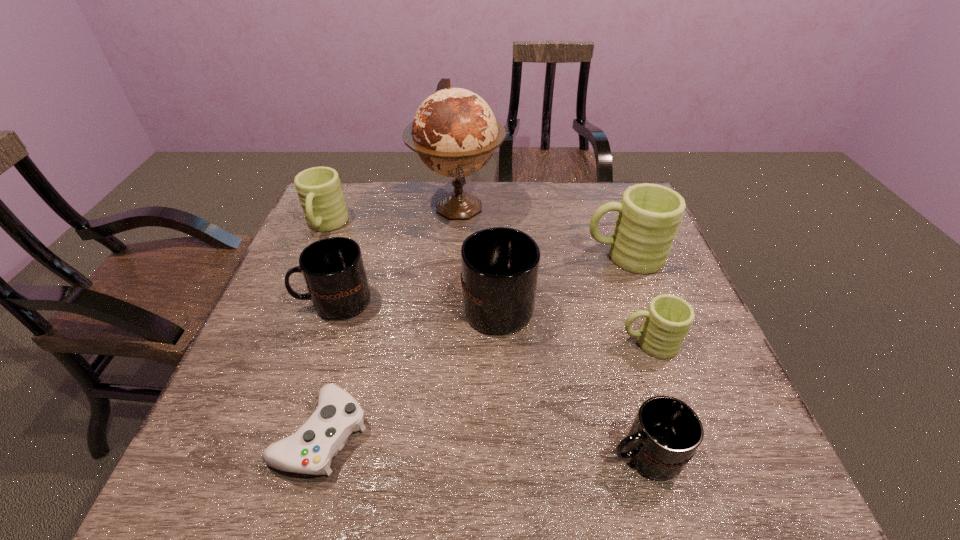
Find the location of a particular element. This screenshot has height=540, width=960. control at the left edge is located at coordinates (310, 450).

Image resolution: width=960 pixels, height=540 pixels. Identify the location of object that is at the far left corner. (320, 194).

Image resolution: width=960 pixels, height=540 pixels. Identify the location of object that is at the near left corner. (310, 450).

At what (x,y) coordinates should I click in order to perform the action: click on object that is positioned at the near right corner. Please return your answer as a coordinate pair (x, y). Image resolution: width=960 pixels, height=540 pixels. Looking at the image, I should click on (666, 432).

Image resolution: width=960 pixels, height=540 pixels. I want to click on free region at the far edge, so click(506, 210).

The image size is (960, 540). Identify the location of vacant space at the near edge of the desktop. (450, 463).

The image size is (960, 540). In the image, there is a desktop. In order to click on free space at the left edge in this screenshot , I will do `click(319, 353)`.

Where is `free spot at the right edge of the desktop`? Image resolution: width=960 pixels, height=540 pixels. free spot at the right edge of the desktop is located at coordinates (735, 404).

The image size is (960, 540). In the image, there is a desktop. What are the coordinates of `vacant space at the far left corner` in the screenshot? It's located at (360, 184).

Find the location of a particular element. unoccupied area between the smallest green mug and the second black mug from right to left is located at coordinates (573, 322).